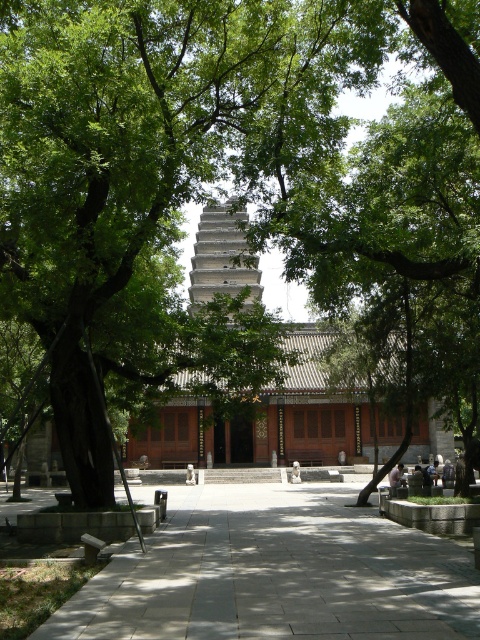
You are standing at point (223, 257) in the image. What structure is located at your current position?

The gray stone tower at center is located at point (223, 257).

You are a visitor standing at the entrance of the temple complex. You see the gray stone tower at center and the light brown wooden bench at center. Which object is closer to you?

The gray stone tower at center is closer to you because it is positioned in front of the light brown wooden bench at center.